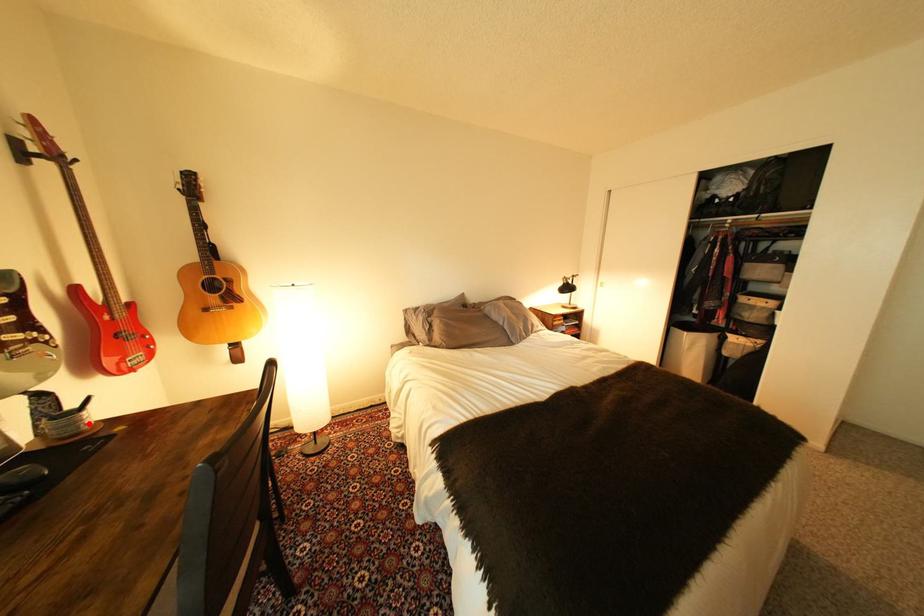
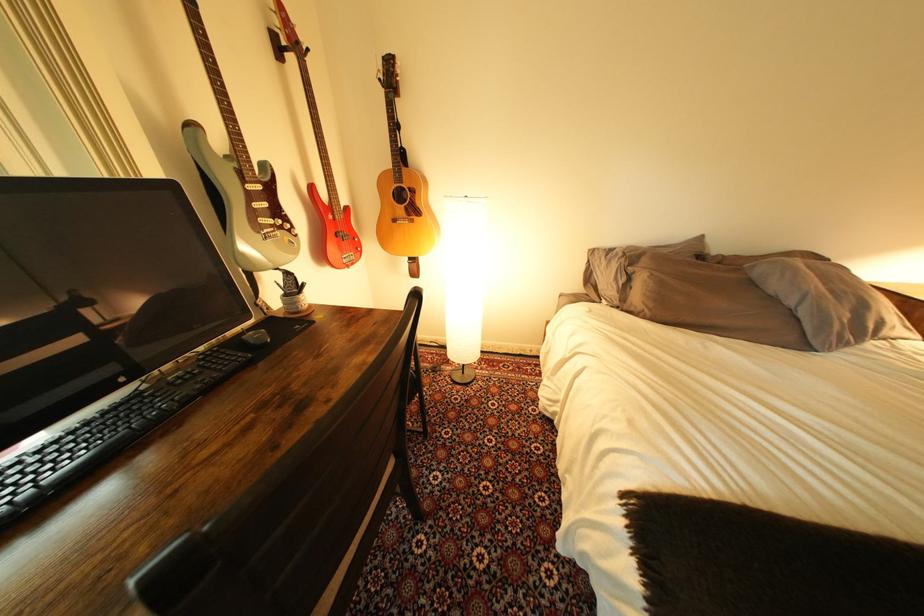
The point at the highlighted location is marked in the first image. Where is the corresponding point in the second image?

(309, 304)